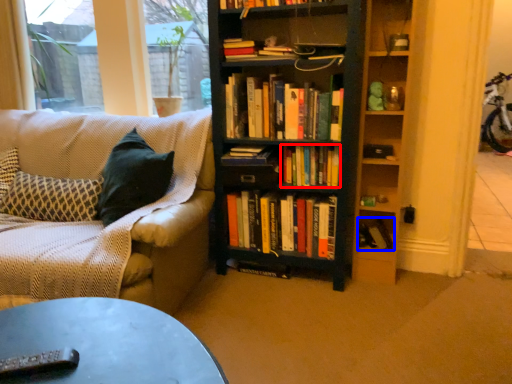
Question: Which point is further to the camera, book (highlighted by a red box) or book (highlighted by a blue box)?

Choices:
 (A) book
 (B) book

Answer: (B)